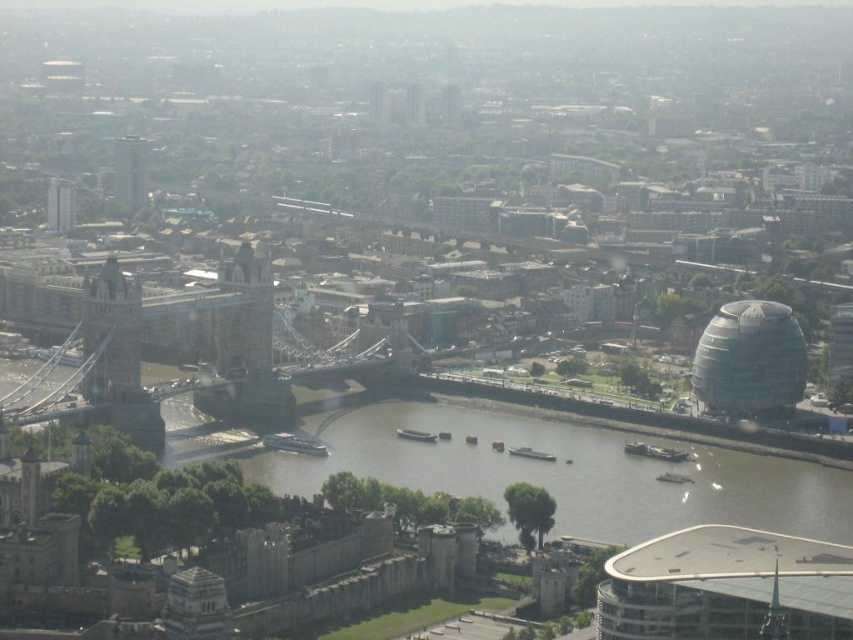
In the scene shown: You are an urban planner assessing the city layout. You need to determine if the white glass dome at right can be moved to the location currently occupied by the matte gray building at upper left. Based on their sizes, will it fit without requiring any modifications?

The white glass dome at right is wider than the matte gray building at upper left. Therefore, moving the white glass dome at right to the matte gray building at upper left location would not fit without modifications.

You are a drone operator trying to capture a photo of the white glass dome at right. Your drone is currently at the point with coordinates point (749, 358). Is the drone currently positioned over the white glass dome at right?

Yes, the point (749, 358) corresponds to the white glass dome at right, so the drone is currently positioned over the white glass dome at right.

You are a drone operator who needs to fly a drone between the white glass dome at right and the matte gray bridge at left. Based on their heights, will the drone need to ascend or descend to pass safely between them?

The white glass dome at right is shorter than the matte gray bridge at left, so the drone will need to ascend to pass safely between them.